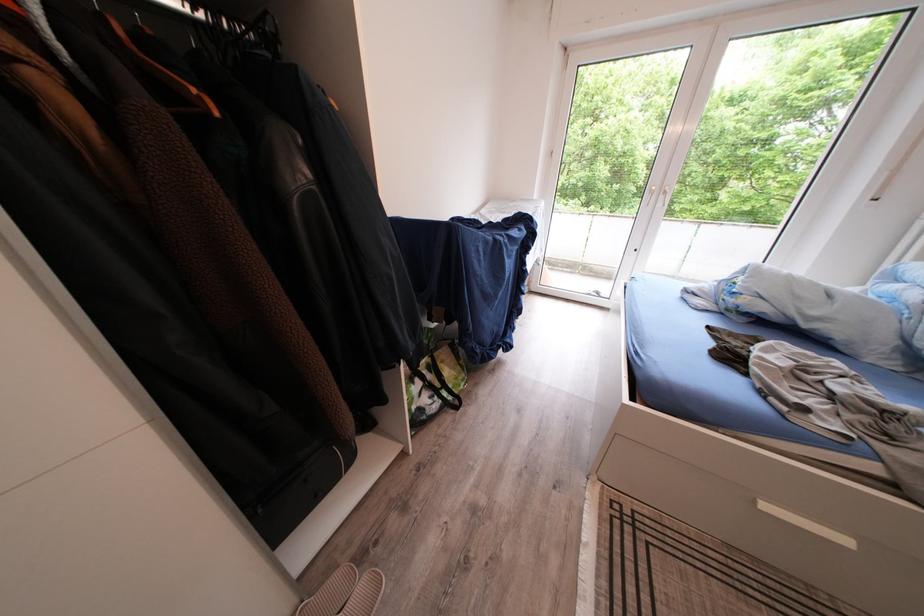
Find where to hang the black hanger hook. Please return your answer as a coordinate pair (x, y).

(237, 21)